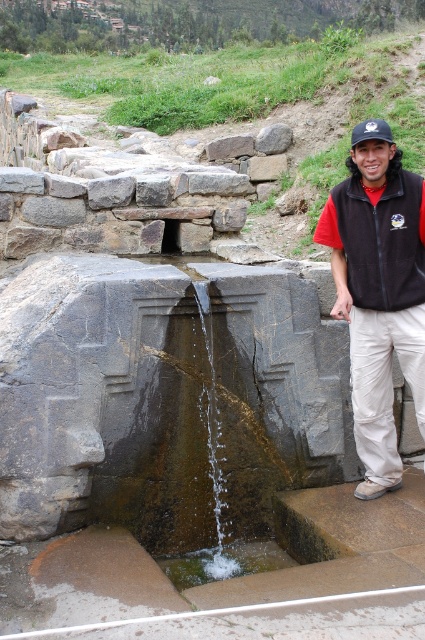
You are a tour guide explaining the historical water feature to visitors. You point to the black fleece vest at center and the gray rough stone at center in the image. Which object is positioned lower in the scene?

The black fleece vest at center is below the gray rough stone at center, so the black fleece vest at center is positioned lower in the scene.

You are a visitor at this historical site and want to take a photo of the clear water at center and the gray rough rock at center. Which object should you focus on first if you want to capture both in a single frame without moving the camera?

You should focus on the gray rough rock at center first because it is wider than the clear water at center, so it will occupy more space in the frame.